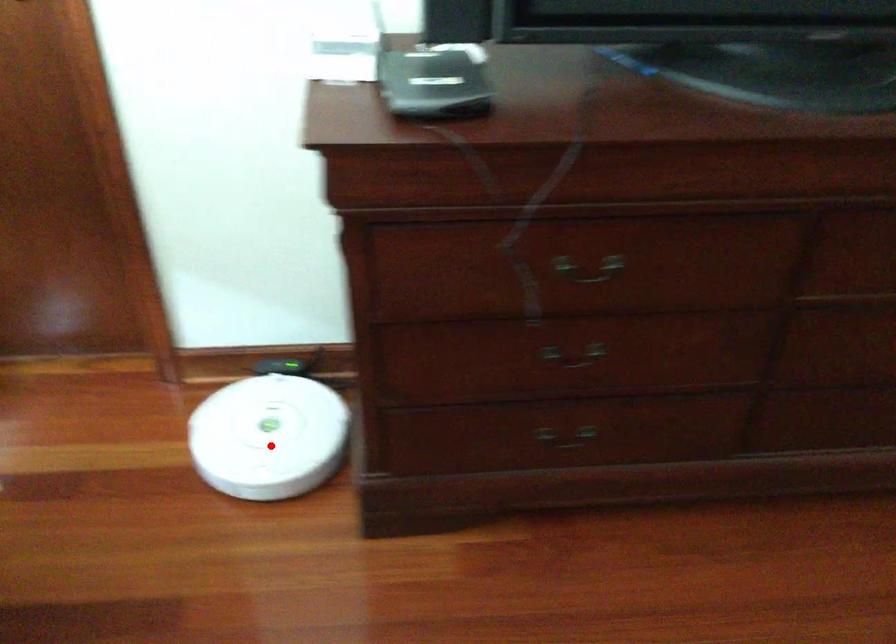
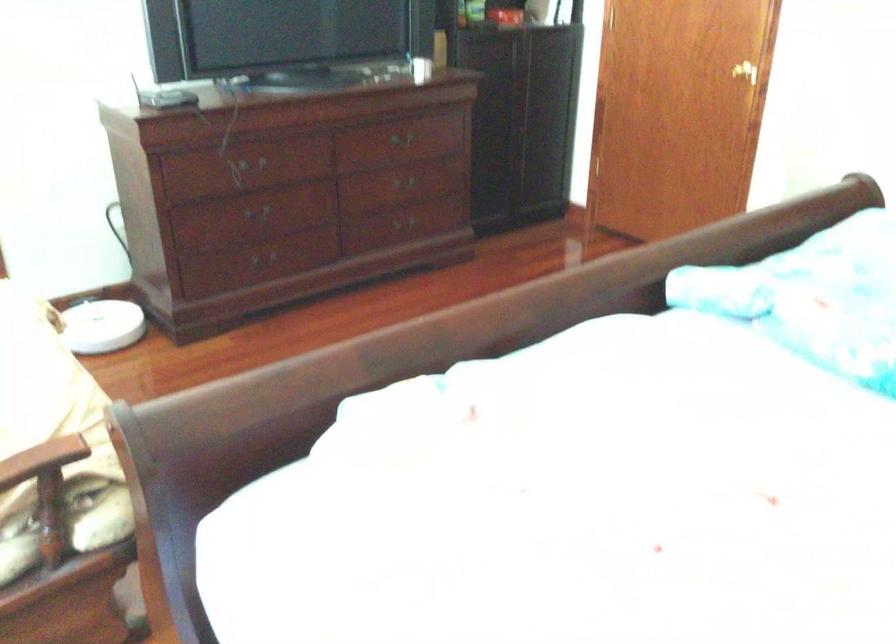
Question: I am providing you with two images of the same scene from different viewpoints. Given a red point in image1, look at the same physical point in image2. Is it:

Choices:
 (A) Closer to the viewpoint
 (B) Farther from the viewpoint

Answer: (B)